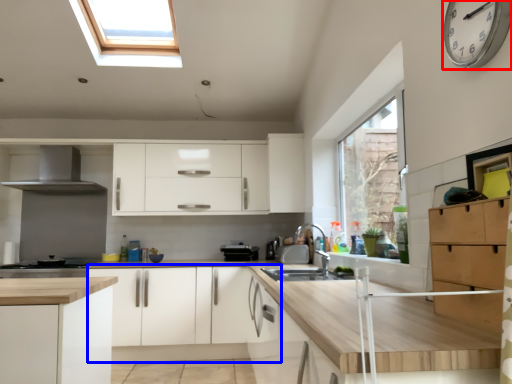
Question: Which of the following is the farthest to the observer, clock (highlighted by a red box) or cabinetry (highlighted by a blue box)?

Choices:
 (A) clock
 (B) cabinetry

Answer: (B)